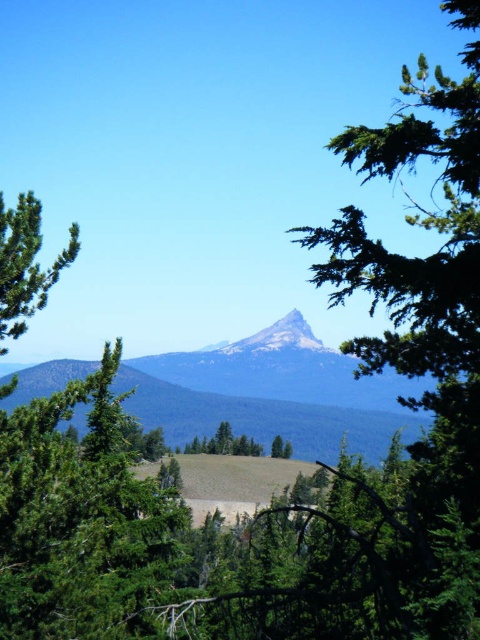
Can you confirm if smooth gray mountain at center is positioned to the right of green matte tree at left?

Indeed, smooth gray mountain at center is positioned on the right side of green matte tree at left.

Who is positioned more to the right, smooth gray mountain at center or green matte tree at left?

Positioned to the right is smooth gray mountain at center.

Identify the location of smooth gray mountain at center. This screenshot has height=640, width=480. (272, 394).

Does green needle-like tree at center have a greater height compared to green matte tree at center?

Correct, green needle-like tree at center is much taller as green matte tree at center.

Between point (95, 412) and point (289, 448), which one is positioned behind?

The point (289, 448) is more distant.

Identify the location of green needle-like tree at center. (82, 522).

Can you confirm if green matte tree at left is wider than green matte tree at center?

No, green matte tree at left is not wider than green matte tree at center.

Is point (32, 285) behind point (184, 444)?

No, (32, 285) is in front of (184, 444).

Where is `green matte tree at left`? This screenshot has width=480, height=640. green matte tree at left is located at coordinates (25, 262).